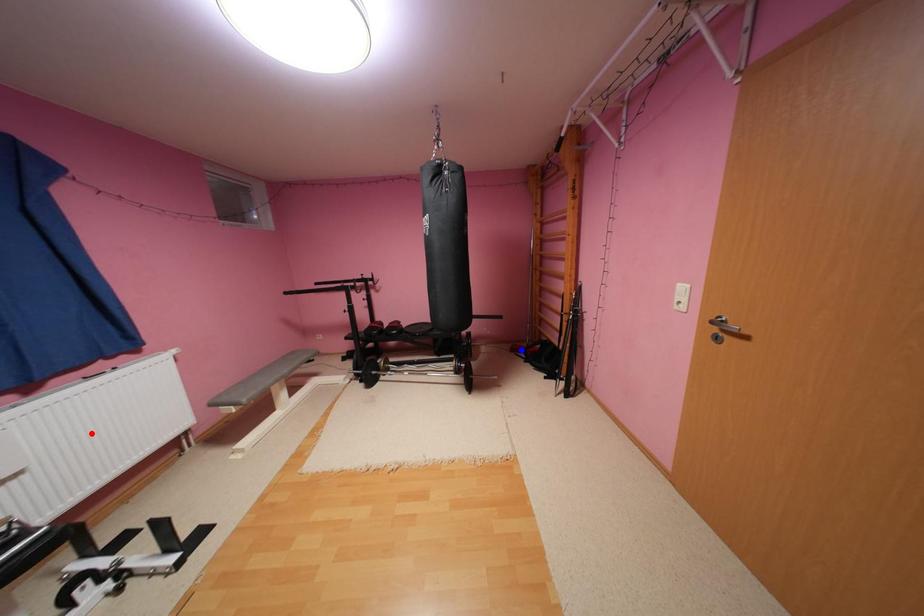
Question: Which of the two points in the image is closer to the camera?

Choices:
 (A) Blue point is closer.
 (B) Red point is closer.

Answer: (B)